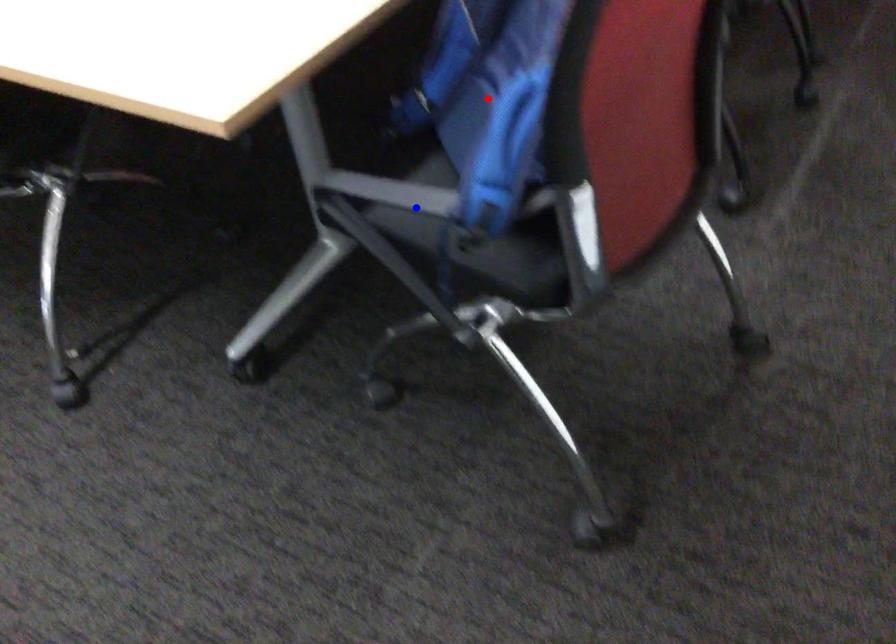
Question: In the image, two points are highlighted. Which point is nearer to the camera? Reply with the corresponding letter.

Choices:
 (A) blue point
 (B) red point

Answer: (B)